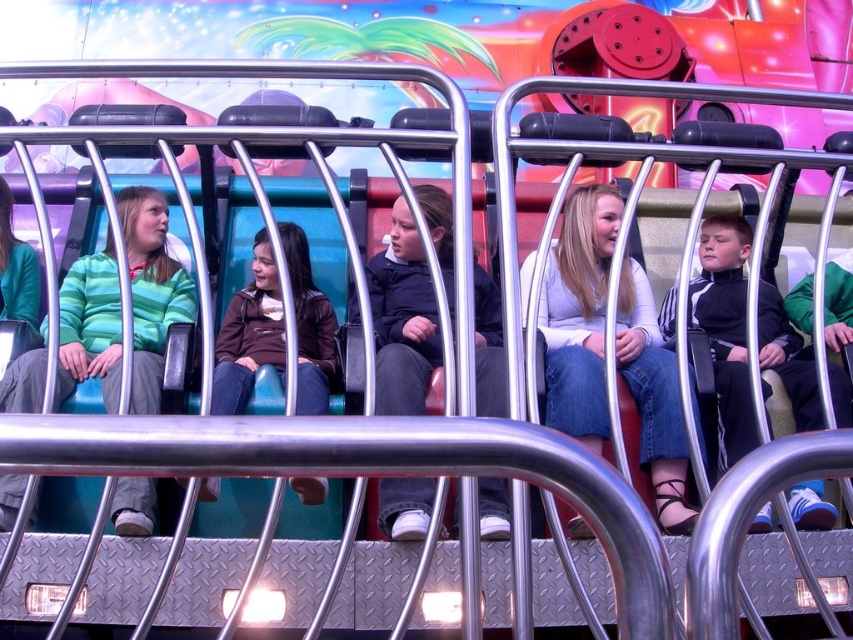
You are a photographer trying to capture a photo of the dark blue jacket at center and the brown leather jacket at center. Since you want both jackets in the frame, which jacket should you position your camera closer to in order to include both?

You should position your camera closer to the brown leather jacket at center because the dark blue jacket at center is to the right of it, so moving closer to the brown one would help capture both in the frame.

You are a photographer trying to capture a photo of the denim jeans at center and dark blue jacket at center from the ground. Can you see both items in your camera viewfinder at the same time?

The denim jeans at center is located above the dark blue jacket at center, so yes, both items can be seen in the camera viewfinder simultaneously as they are positioned one above the other.